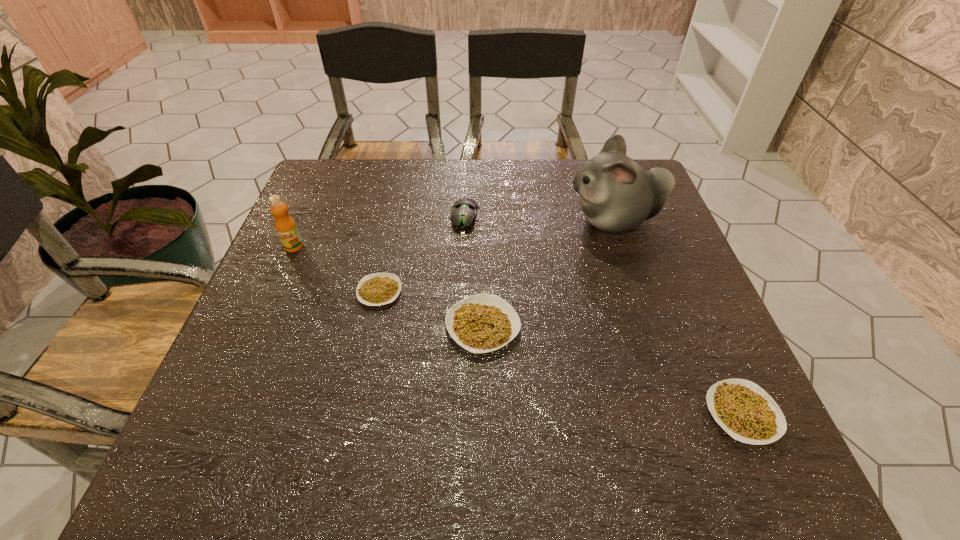
The width and height of the screenshot is (960, 540). Identify the location of object that is at the left edge. click(286, 228).

You are a GUI agent. You are given a task and a screenshot of the screen. Output one action in this format:
    pyautogui.click(x=<x>, y=<y>)
    Task: Click on the legume that is positioned at the right edge
    
    Given the screenshot: What is the action you would take?
    pyautogui.click(x=743, y=409)

Where is `hamster located at the right edge`? Image resolution: width=960 pixels, height=540 pixels. hamster located at the right edge is located at coordinates (617, 194).

Find the location of a particular element. object that is at the far right corner is located at coordinates (617, 194).

Identify the location of object present at the near right corner. Image resolution: width=960 pixels, height=540 pixels. (743, 409).

Find the location of a particular element. The height and width of the screenshot is (540, 960). vacant space at the far edge is located at coordinates 372,174.

Image resolution: width=960 pixels, height=540 pixels. In order to click on vacant space at the near edge of the desktop in this screenshot , I will do `click(373, 404)`.

In the image, there is a desktop. In order to click on vacant space at the left edge in this screenshot , I will do `click(269, 296)`.

Locate an element on the screen. vacant area at the far left corner is located at coordinates (336, 180).

Identify the location of free area in between the orange juice and the tallest object. (453, 234).